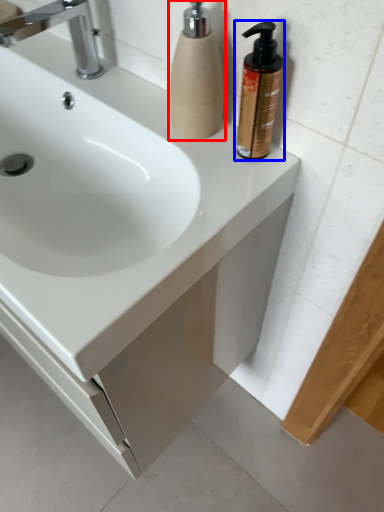
Question: Which object appears farthest to the camera in this image, soap dispenser (highlighted by a red box) or soap dispenser (highlighted by a blue box)?

Choices:
 (A) soap dispenser
 (B) soap dispenser

Answer: (A)